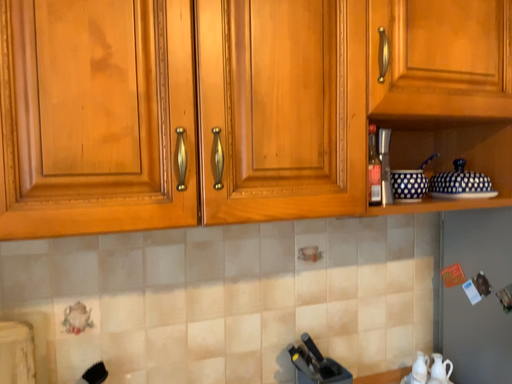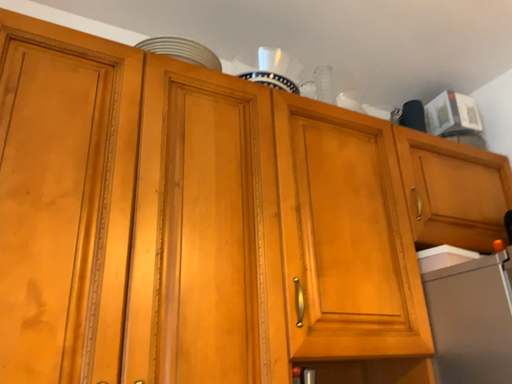
Question: How did the camera likely rotate when shooting the video?

Choices:
 (A) rotated downward
 (B) rotated upward

Answer: (B)